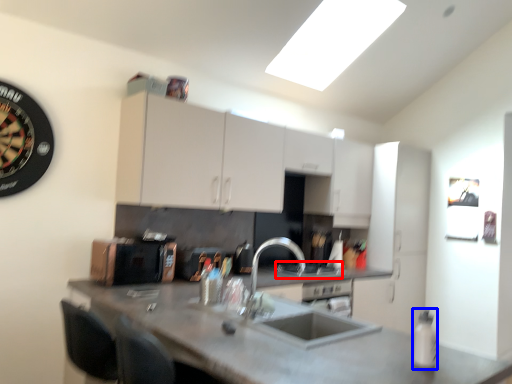
Question: Which of the following is the farthest to the observer, gas stove (highlighted by a red box) or bottle (highlighted by a blue box)?

Choices:
 (A) gas stove
 (B) bottle

Answer: (A)